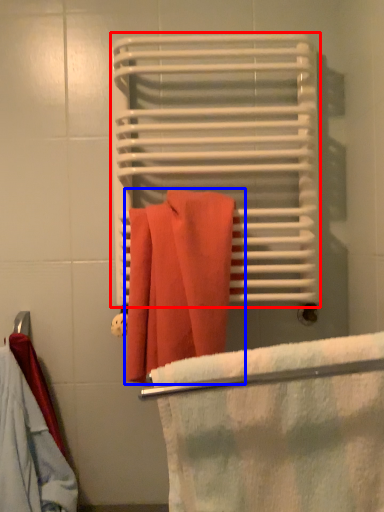
Question: Which object is further to the camera taking this photo, bath towel (highlighted by a red box) or towel (highlighted by a blue box)?

Choices:
 (A) bath towel
 (B) towel

Answer: (A)